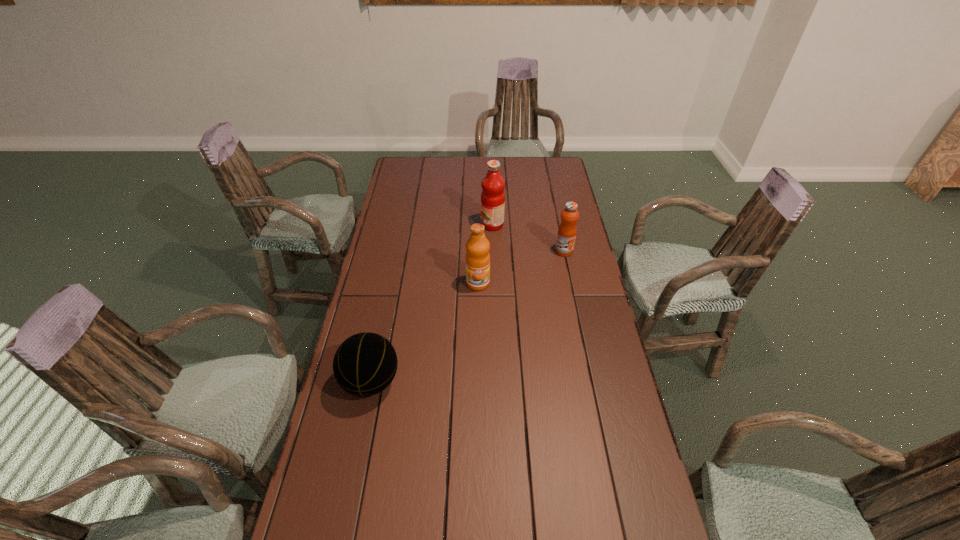
Locate an element on the screen. The height and width of the screenshot is (540, 960). vacant area between the shortest object and the nearest fruit juice is located at coordinates (424, 332).

The height and width of the screenshot is (540, 960). I want to click on vacant region between the farthest fruit juice and the shortest object, so click(432, 303).

Identify the location of free space that is in between the leftmost object and the second nearest object. (424, 332).

Choose which object is the second nearest neighbor to the nearest fruit juice. Please provide its 2D coordinates. Your answer should be formatted as a tuple, i.e. [(x, y)], where the tuple contains the x and y coordinates of a point satisfying the conditions above.

[(567, 230)]

The width and height of the screenshot is (960, 540). I want to click on object that can be found as the third closest to the shortest fruit juice, so click(365, 364).

What are the coordinates of `the second closest fruit juice to the second nearest object` in the screenshot? It's located at (567, 230).

The width and height of the screenshot is (960, 540). I want to click on the closest fruit juice to the second farthest fruit juice, so click(x=492, y=196).

Find the location of a particular element. free space that satisfies the following two spatial constraints: 1. on the front label of the farthest fruit juice; 2. on the label side of the third farthest object is located at coordinates (494, 283).

Locate an element on the screen. The width and height of the screenshot is (960, 540). free space that satisfies the following two spatial constraints: 1. on the front label of the farthest fruit juice; 2. on the label side of the second nearest object is located at coordinates (494, 283).